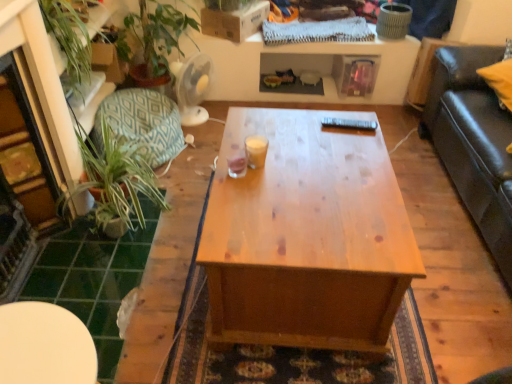
The width and height of the screenshot is (512, 384). In order to click on free space in front of translucent glass cup at center, the 2th coffee cup in the left-to-right sequence in this screenshot , I will do `click(252, 190)`.